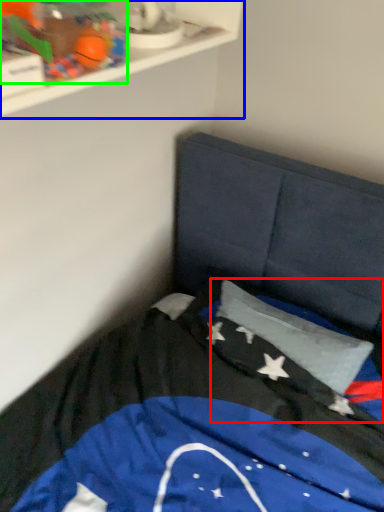
Question: Which object is the closest to the flag (highlighted by a red box)? Choose among these: shelf (highlighted by a blue box) or toy (highlighted by a green box).

Choices:
 (A) shelf
 (B) toy

Answer: (A)